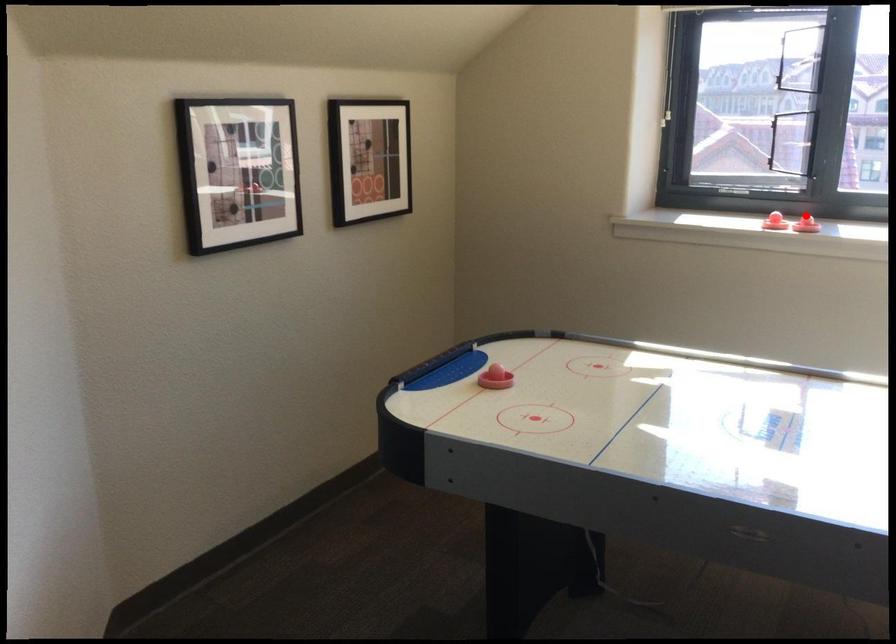
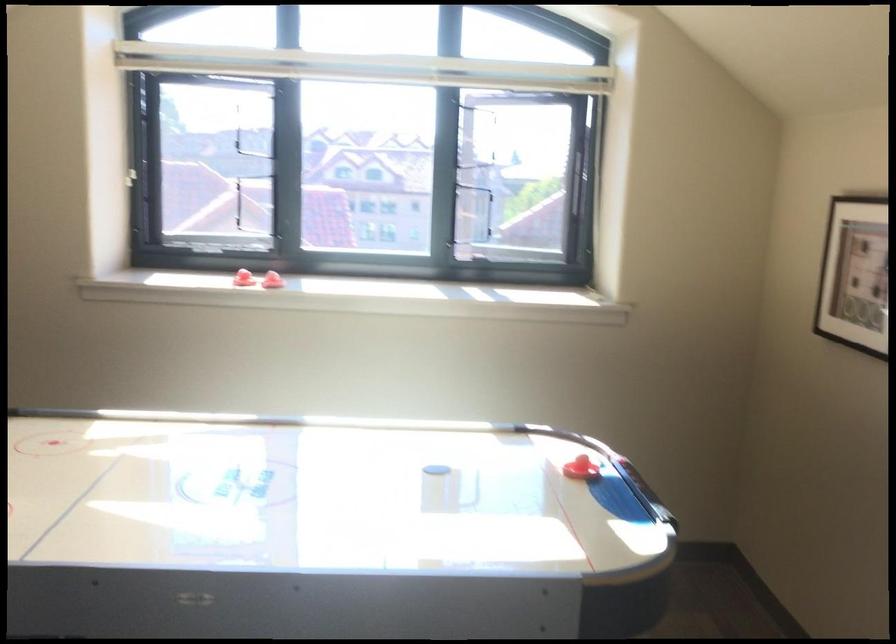
Find the pixel in the second image that matches the highlighted location in the first image.

(271, 279)